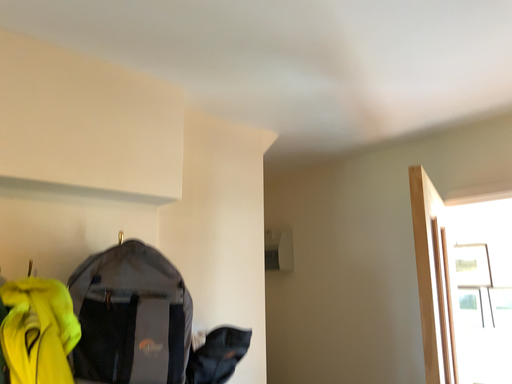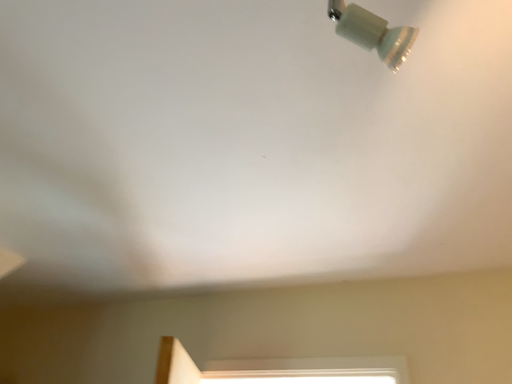
Question: Which way did the camera rotate in the video?

Choices:
 (A) rotated left
 (B) rotated right

Answer: (B)